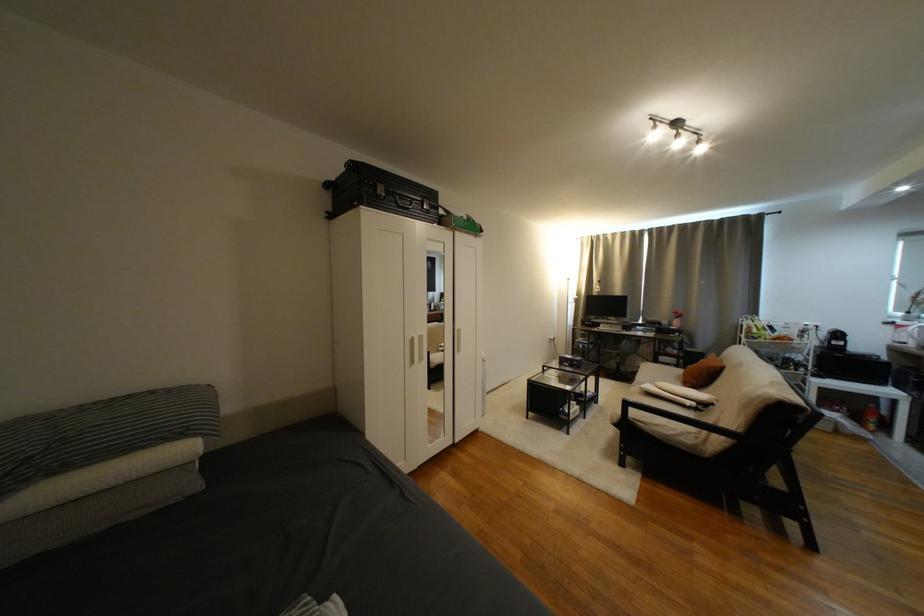
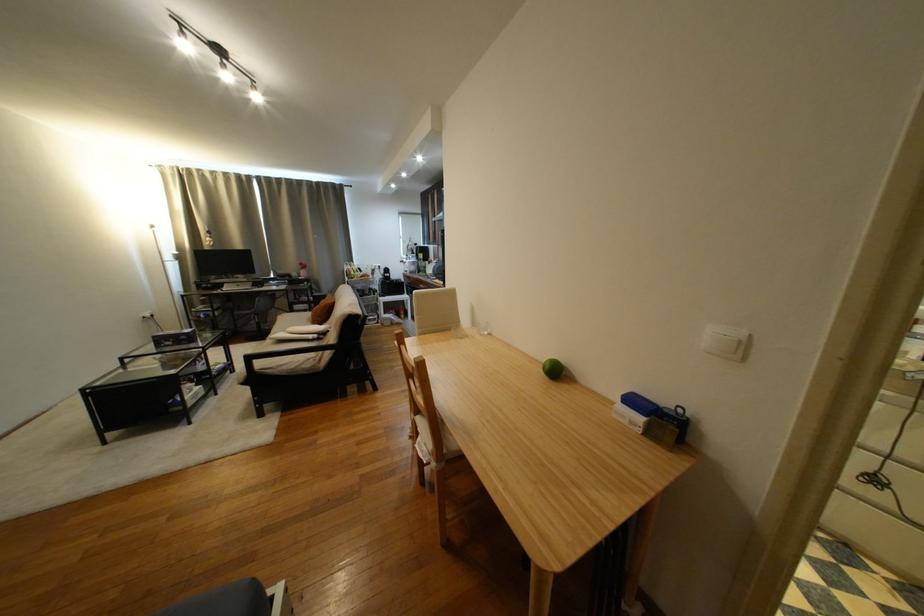
Find the pixel in the second image that matches (693,376) in the first image.

(321, 317)